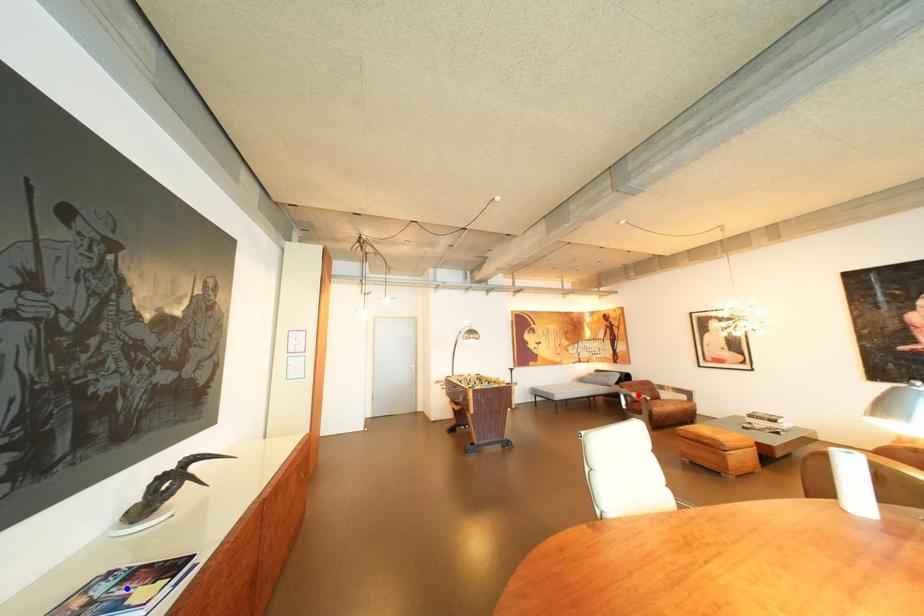
Question: In the image, two points are highlighted. Which point is nearer to the camera? Reply with the corresponding letter.

Choices:
 (A) blue point
 (B) red point

Answer: (A)